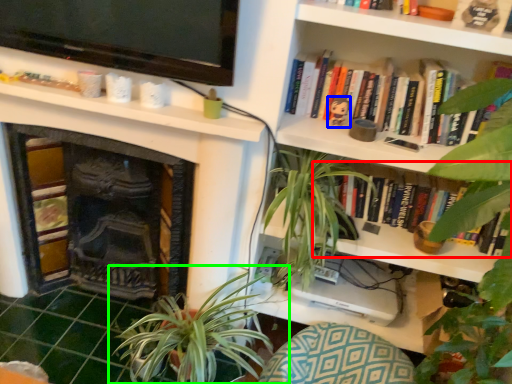
Question: Which object is positioned farthest from book (highlighted by a red box)? Select from toy (highlighted by a blue box) and houseplant (highlighted by a green box).

Choices:
 (A) toy
 (B) houseplant

Answer: (B)